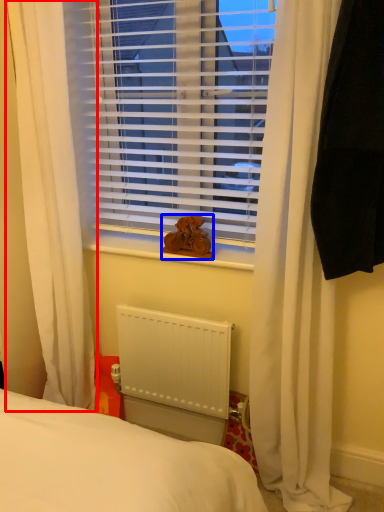
Question: Which point is further to the camera, curtain (highlighted by a red box) or animal (highlighted by a blue box)?

Choices:
 (A) curtain
 (B) animal

Answer: (B)